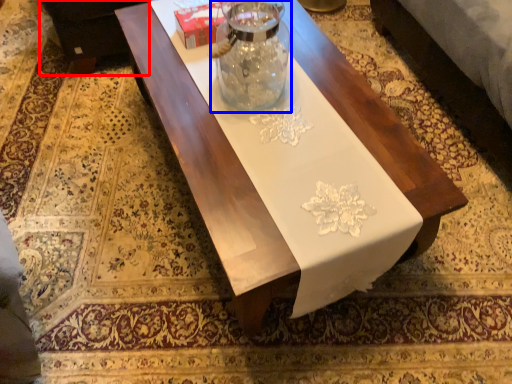
Question: Which point is further to the camera, couch (highlighted by a red box) or glass vase (highlighted by a blue box)?

Choices:
 (A) couch
 (B) glass vase

Answer: (A)